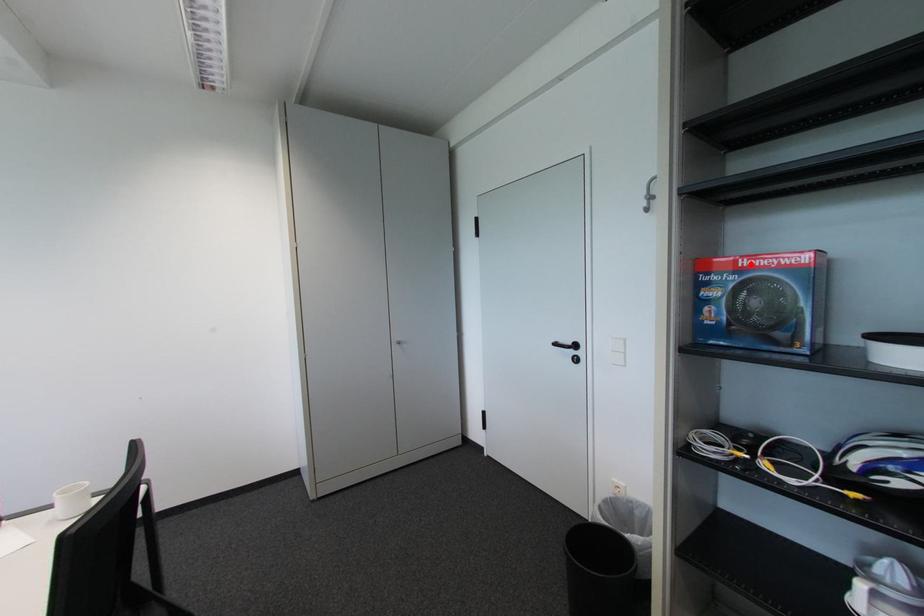
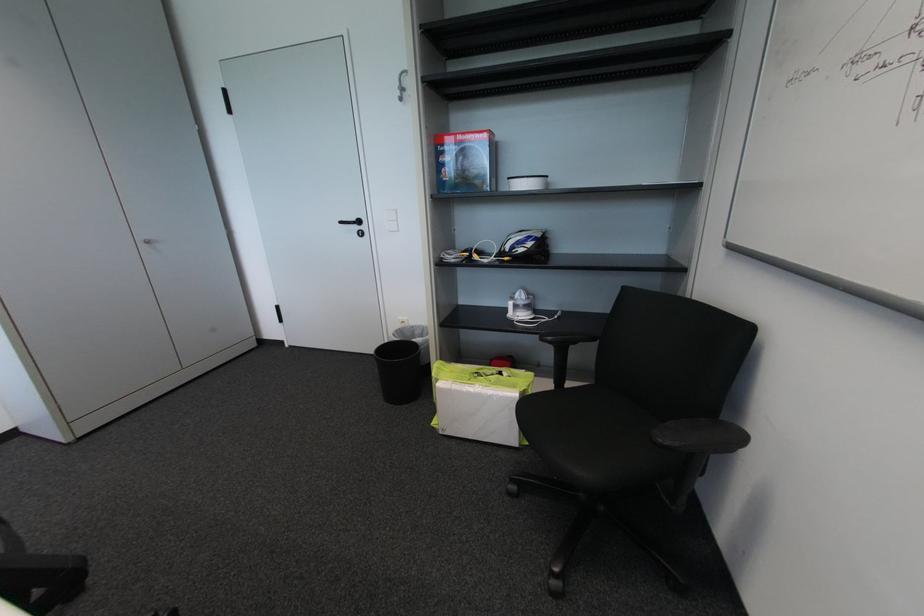
The point at the highlighted location is marked in the first image. Where is the corresponding point in the second image?

(466, 139)